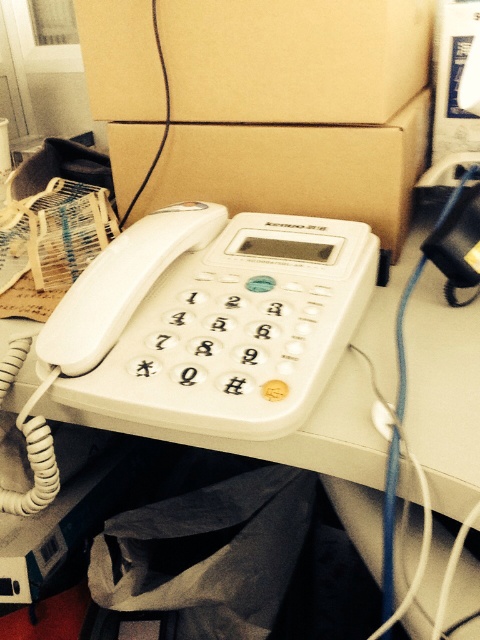
Question: Does white plastic phone at upper center have a greater width compared to brown cardboard box at center?

Choices:
 (A) yes
 (B) no

Answer: (A)

Question: Where is white plastic phone at upper center located in relation to brown cardboard box at center in the image?

Choices:
 (A) right
 (B) left

Answer: (B)

Question: Which point is closer to the camera taking this photo?

Choices:
 (A) (300, 195)
 (B) (384, 449)

Answer: (B)

Question: Does white plastic phone at upper center have a larger size compared to brown cardboard box at center?

Choices:
 (A) no
 (B) yes

Answer: (B)